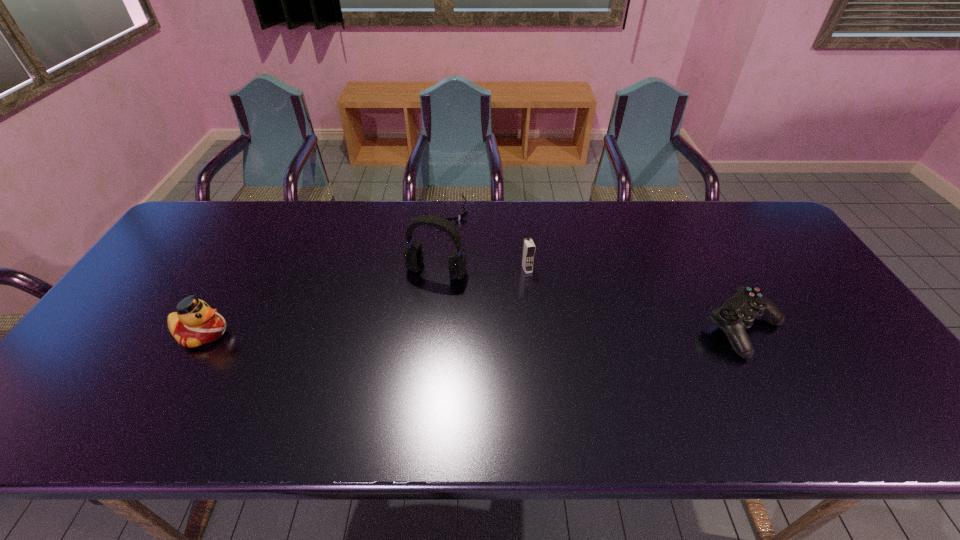
Image resolution: width=960 pixels, height=540 pixels. Find the location of `free space between the sunglasses and the leftmost object`. free space between the sunglasses and the leftmost object is located at coordinates (324, 272).

This screenshot has height=540, width=960. I want to click on vacant region between the fourth object from left to right and the sunglasses, so click(x=485, y=240).

The height and width of the screenshot is (540, 960). I want to click on vacant space in between the second object from right to left and the control, so click(636, 299).

Find the location of a particular element. The image size is (960, 540). free spot between the fourth object from left to right and the duck is located at coordinates (365, 301).

In order to click on blank region between the second object from right to left and the headset in this screenshot , I will do `click(482, 270)`.

Find the location of a particular element. object that is the third closest to the second object from right to left is located at coordinates (739, 312).

Locate which object ranks in proximity to the leftmost object. Please provide its 2D coordinates. Your answer should be formatted as a tuple, i.e. [(x, y)], where the tuple contains the x and y coordinates of a point satisfying the conditions above.

[(413, 254)]